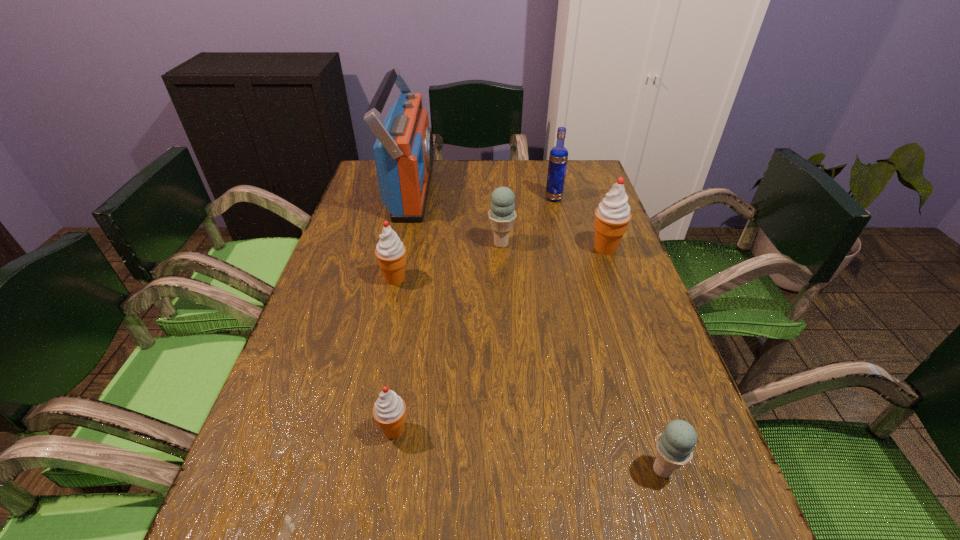
At what (x,y) coordinates should I click in order to perform the action: click on ice cream that stands as the fifth closest to the radio receiver. Please return your answer as a coordinate pair (x, y). The width and height of the screenshot is (960, 540). Looking at the image, I should click on (674, 446).

Locate which ice cream is the fifth closest to the tallest object. Please provide its 2D coordinates. Your answer should be formatted as a tuple, i.e. [(x, y)], where the tuple contains the x and y coordinates of a point satisfying the conditions above.

[(674, 446)]

Select which red icecream is the closest to the tallest ice cream. Please provide its 2D coordinates. Your answer should be formatted as a tuple, i.e. [(x, y)], where the tuple contains the x and y coordinates of a point satisfying the conditions above.

[(391, 253)]

At what (x,y) coordinates should I click in order to perform the action: click on red icecream that is the closest to the third nearest object. Please return your answer as a coordinate pair (x, y). The height and width of the screenshot is (540, 960). Looking at the image, I should click on (389, 411).

Locate an element on the screen. Image resolution: width=960 pixels, height=540 pixels. blank area in the image that satisfies the following two spatial constraints: 1. on the front-facing side of the sixth farthest object; 2. on the left side of the tallest object is located at coordinates (357, 430).

Locate an element on the screen. The image size is (960, 540). blank space that satisfies the following two spatial constraints: 1. on the front-facing side of the blue radio receiver; 2. on the right side of the second smallest red icecream is located at coordinates (392, 279).

The height and width of the screenshot is (540, 960). Find the location of `vacant region that satisfies the following two spatial constraints: 1. on the front-facing side of the tallest object; 2. on the right side of the tallest ice cream`. vacant region that satisfies the following two spatial constraints: 1. on the front-facing side of the tallest object; 2. on the right side of the tallest ice cream is located at coordinates (398, 248).

You are a GUI agent. You are given a task and a screenshot of the screen. Output one action in this format:
    pyautogui.click(x=<x>, y=<y>)
    Task: Click on the vacant space that satisfies the following two spatial constraints: 1. on the front-facing side of the tallest object; 2. on the back side of the third nearest ice cream
    
    Given the screenshot: What is the action you would take?
    pyautogui.click(x=392, y=279)

I want to click on vacant position in the image that satisfies the following two spatial constraints: 1. on the front-facing side of the farther blue ice cream; 2. on the left side of the blue radio receiver, so click(399, 244).

The image size is (960, 540). I want to click on vacant space that satisfies the following two spatial constraints: 1. on the front-facing side of the radio receiver; 2. on the left side of the vodka, so click(x=410, y=198).